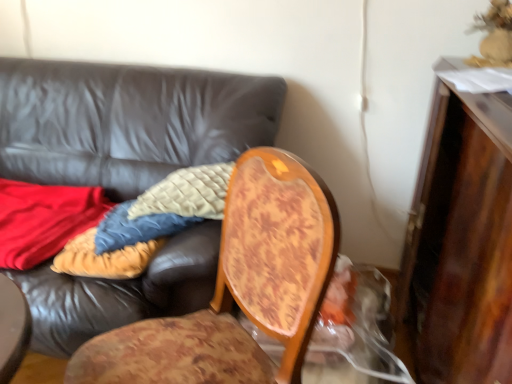
What is the approximate width of leather couch at center?

The width of leather couch at center is 3.52 feet.

This screenshot has width=512, height=384. What do you see at coordinates (239, 287) in the screenshot? I see `wooden chair at center` at bounding box center [239, 287].

Locate an element on the screen. The image size is (512, 384). wooden dresser at right is located at coordinates (462, 242).

In terms of size, does leather couch at center appear bigger or smaller than wooden chair at center?

Clearly, leather couch at center is larger in size than wooden chair at center.

From the image's perspective, is leather couch at center located above wooden chair at center?

Yes, from the image's perspective, leather couch at center is above wooden chair at center.

Locate an element on the screen. studio couch located behind the wooden chair at center is located at coordinates (127, 122).

Is leather couch at center facing towards wooden chair at center?

Yes, leather couch at center is aimed at wooden chair at center.

Based on the photo, how many degrees apart are the facing directions of wooden chair at center and wooden dresser at right?

53.2 degrees.

Consider the image. From the image's perspective, which object appears higher, wooden chair at center or wooden dresser at right?

wooden dresser at right, from the image's perspective.

Where is `dresser in front of the wooden chair at center`? Image resolution: width=512 pixels, height=384 pixels. dresser in front of the wooden chair at center is located at coordinates (462, 242).

From a real-world perspective, which is physically below, wooden chair at center or wooden dresser at right?

wooden chair at center, from a real-world perspective.

Could you tell me if wooden dresser at right is turned towards leather couch at center?

Yes.

Where is `studio couch on the left of wooden dresser at right`? studio couch on the left of wooden dresser at right is located at coordinates (127, 122).

Is wooden dresser at right to the left or to the right of leather couch at center in the image?

wooden dresser at right is positioned on leather couch at center's right side.

Is the surface of leather couch at center in direct contact with wooden dresser at right?

No, leather couch at center is not in contact with wooden dresser at right.

How many degrees apart are the facing directions of leather couch at center and wooden dresser at right?

They differ by 90.1 degrees in their facing directions.

Considering the relative positions of leather couch at center and wooden dresser at right in the image provided, is leather couch at center to the left or to the right of wooden dresser at right?

From the image, it's evident that leather couch at center is to the left of wooden dresser at right.

From the image's perspective, is wooden dresser at right on wooden chair at center?

Correct, wooden dresser at right appears higher than wooden chair at center in the image.

How much distance is there between wooden dresser at right and wooden chair at center?

The distance of wooden dresser at right from wooden chair at center is 19.72 inches.

Is wooden dresser at right spatially inside wooden chair at center, or outside of it?

wooden dresser at right exists outside the volume of wooden chair at center.

Considering the sizes of wooden chair at center and leather couch at center in the image, is wooden chair at center wider or thinner than leather couch at center?

In the image, wooden chair at center appears to be more narrow than leather couch at center.

Considering the positions of objects wooden chair at center and leather couch at center in the image provided, who is behind, wooden chair at center or leather couch at center?

leather couch at center is more distant.

From the image's perspective, which one is positioned lower, wooden chair at center or leather couch at center?

wooden chair at center appears lower in the image.

Is wooden chair at center taller or shorter than leather couch at center?

wooden chair at center is shorter than leather couch at center.

This screenshot has width=512, height=384. I want to click on studio couch above the wooden chair at center (from a real-world perspective), so click(127, 122).

Where is `dresser that appears on the right of wooden chair at center`? The image size is (512, 384). dresser that appears on the right of wooden chair at center is located at coordinates (462, 242).

Estimate the real-world distances between objects in this image. Which object is further from wooden dresser at right, leather couch at center or wooden chair at center?

leather couch at center lies further to wooden dresser at right than the other object.

Considering their positions, is wooden dresser at right positioned closer to wooden chair at center than leather couch at center?

The object closer to wooden chair at center is wooden dresser at right.

Which object lies further to the anchor point leather couch at center, wooden dresser at right or wooden chair at center?

Based on the image, wooden dresser at right appears to be further to leather couch at center.

In the scene shown: When comparing their distances from leather couch at center, does wooden chair at center or wooden dresser at right seem further?

wooden dresser at right is further to leather couch at center.

From the image, which object appears to be farther from wooden dresser at right, wooden chair at center or leather couch at center?

Answer: leather couch at center lies further to wooden dresser at right than the other object.

Looking at this image, from the image, which object appears to be nearer to wooden chair at center, leather couch at center or wooden dresser at right?

wooden dresser at right is positioned closer to the anchor wooden chair at center.

Where is `chair between leather couch at center and wooden dresser at right from left to right`? chair between leather couch at center and wooden dresser at right from left to right is located at coordinates (239, 287).